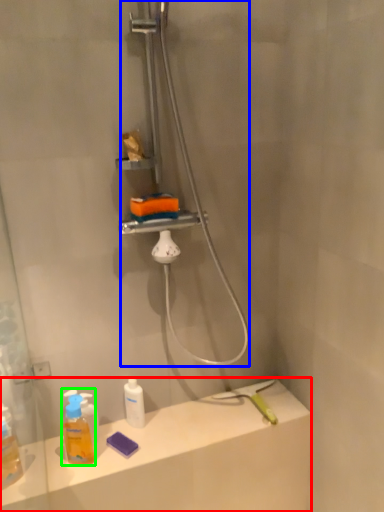
Question: Which object is the farthest from counter top (highlighted by a red box)? Choose among these: shower (highlighted by a blue box) or mouthwash (highlighted by a green box).

Choices:
 (A) shower
 (B) mouthwash

Answer: (A)